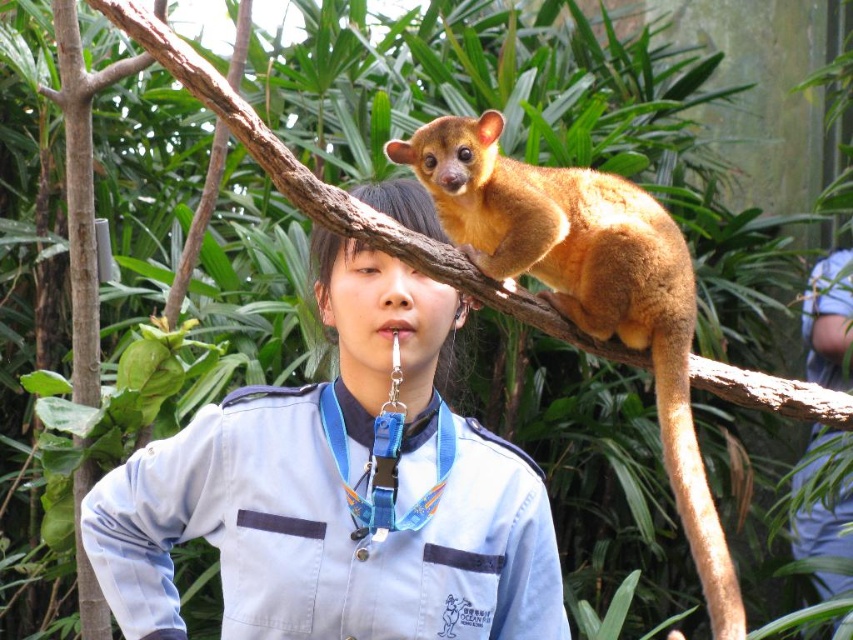
Identify the location of matte brown fur at upper center. This screenshot has height=640, width=853. (329, 525).

In the scene shown: Can you confirm if matte brown fur at upper center is taller than blue lanyard at center?

Indeed, matte brown fur at upper center has a greater height compared to blue lanyard at center.

Locate an element on the screen. matte brown fur at upper center is located at coordinates (329, 525).

Is golden-brown fur at upper right positioned in front of blue lanyard at center?

Yes.

The image size is (853, 640). What are the coordinates of `golden-brown fur at upper right` in the screenshot? It's located at (587, 289).

Is point (688, 392) closer to viewer compared to point (416, 413)?

Yes, point (688, 392) is closer to viewer.

I want to click on golden-brown fur at upper right, so click(x=587, y=289).

Which is in front, point (672, 484) or point (724, 579)?

Positioned in front is point (724, 579).

Which is in front, point (689, 451) or point (709, 552)?

Point (709, 552)

This screenshot has width=853, height=640. In order to click on golden-brown fur at upper right in this screenshot , I will do `click(587, 289)`.